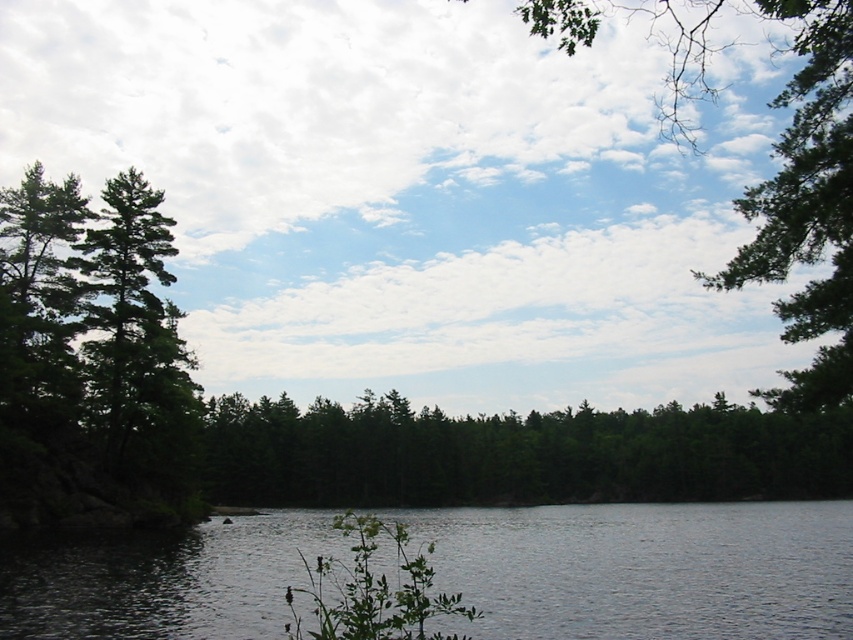
You are standing at the edge of the lake and see the smooth gray water at lower left and the green matte tree at center. Which object is closer to you?

The smooth gray water at lower left is closer to you because it is located above the green matte tree at center, which is further away.

You are a photographer planning to capture a landscape shot of the smooth gray water at lower left and the green leafy tree at upper right. Based on their sizes in the image, which one would appear smaller in your photo?

The smooth gray water at lower left would appear smaller in the photo because its width is less than the green leafy tree at upper right.

You are a hiker standing at the edge of the lake and want to take a photo of the green matte tree at center and the green leafy tree at upper right. Which tree should you focus on if you want both trees to be in sharp focus?

You should focus on the green leafy tree at upper right because it is closer to you than the green matte tree at center, so focusing on the closer tree will ensure both are in focus.